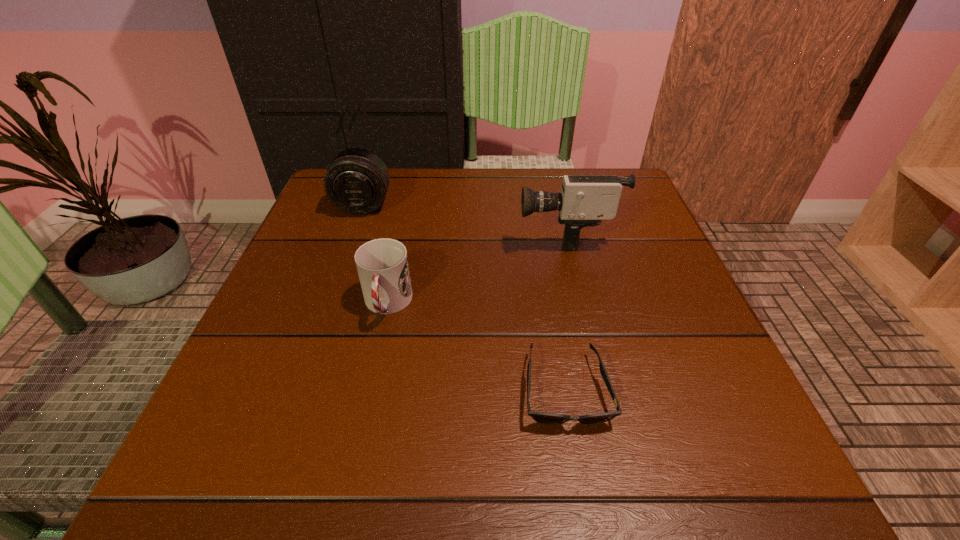
You are a GUI agent. You are given a task and a screenshot of the screen. Output one action in this format:
    pyautogui.click(x=<x>, y=<y>)
    Task: Click on the tallest object
    
    Given the screenshot: What is the action you would take?
    pyautogui.click(x=585, y=200)

You are a GUI agent. You are given a task and a screenshot of the screen. Output one action in this format:
    pyautogui.click(x=<x>, y=<y>)
    Task: Click on the telephoto lens
    The image size is (960, 540).
    Given the screenshot: What is the action you would take?
    pyautogui.click(x=357, y=180)

The image size is (960, 540). I want to click on the second nearest object, so click(382, 264).

Find the location of a particular element. The image size is (960, 540). cup is located at coordinates (382, 264).

This screenshot has width=960, height=540. I want to click on the nearest object, so click(548, 418).

This screenshot has height=540, width=960. Find the location of `the shortest object`. the shortest object is located at coordinates (548, 418).

Locate an element on the screen. The image size is (960, 540). vacant point located on the recording direction of the camcorder is located at coordinates (472, 233).

You are a GUI agent. You are given a task and a screenshot of the screen. Output one action in this format:
    pyautogui.click(x=<x>, y=<y>)
    Task: Click on the vacant space located on the recording direction of the camcorder
    The height and width of the screenshot is (540, 960).
    Given the screenshot: What is the action you would take?
    pyautogui.click(x=477, y=233)

Identify the location of vacant position located 0.140m on the recording direction of the camcorder. (454, 233).

You are a GUI agent. You are given a task and a screenshot of the screen. Output one action in this format:
    pyautogui.click(x=<x>, y=<y>)
    Task: Click on the free region located 0.280m on the front-facing side of the telephoto lens
    The image size is (960, 540).
    Given the screenshot: What is the action you would take?
    (328, 305)